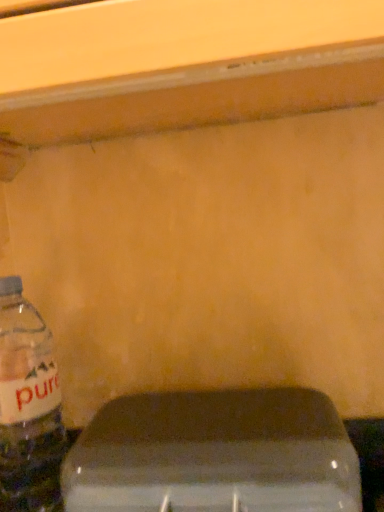
Question: Are transparent plastic water at lower left and translucent plastic bottle at left beside each other?

Choices:
 (A) yes
 (B) no

Answer: (B)

Question: From the image's perspective, would you say transparent plastic water at lower left is shown under translucent plastic bottle at left?

Choices:
 (A) yes
 (B) no

Answer: (A)

Question: Considering the relative positions of transparent plastic water at lower left and translucent plastic bottle at left in the image provided, is transparent plastic water at lower left in front of translucent plastic bottle at left?

Choices:
 (A) yes
 (B) no

Answer: (A)

Question: Is transparent plastic water at lower left smaller than translucent plastic bottle at left?

Choices:
 (A) no
 (B) yes

Answer: (A)

Question: Is translucent plastic bottle at left surrounded by transparent plastic water at lower left?

Choices:
 (A) no
 (B) yes

Answer: (A)

Question: From the image's perspective, is transparent plastic water at lower left on top of translucent plastic bottle at left?

Choices:
 (A) no
 (B) yes

Answer: (A)

Question: From the image's perspective, is translucent plastic bottle at left below transparent plastic water at lower left?

Choices:
 (A) yes
 (B) no

Answer: (B)

Question: Considering the relative sizes of translucent plastic bottle at left and transparent plastic water at lower left in the image provided, is translucent plastic bottle at left shorter than transparent plastic water at lower left?

Choices:
 (A) yes
 (B) no

Answer: (B)

Question: From the image's perspective, is translucent plastic bottle at left located above transparent plastic water at lower left?

Choices:
 (A) no
 (B) yes

Answer: (B)

Question: Does translucent plastic bottle at left lie in front of transparent plastic water at lower left?

Choices:
 (A) no
 (B) yes

Answer: (A)

Question: Is translucent plastic bottle at left positioned far away from transparent plastic water at lower left?

Choices:
 (A) yes
 (B) no

Answer: (B)

Question: Is translucent plastic bottle at left outside transparent plastic water at lower left?

Choices:
 (A) yes
 (B) no

Answer: (A)

Question: From the image's perspective, is translucent plastic bottle at left above or below transparent plastic water at lower left?

Choices:
 (A) above
 (B) below

Answer: (A)